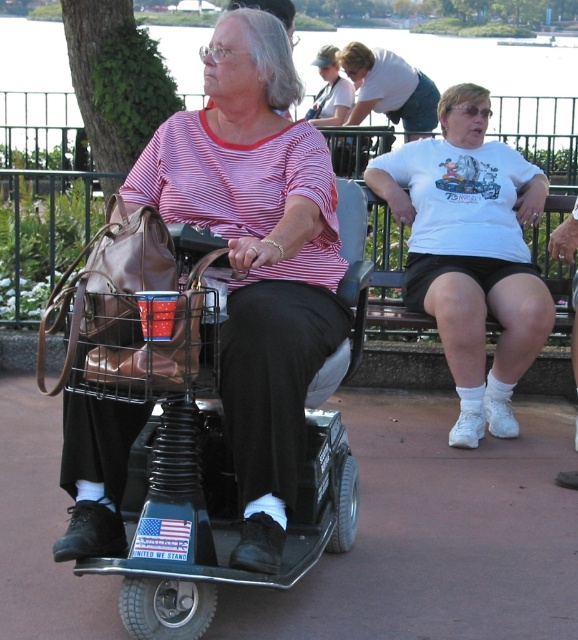
In the scene shown: You are planning to place a small bench in the park scene so that it doesn not block the view of the matte black scooter at center. According to the scene description, where should you position the bench relative to the scooter?

The bench should be positioned behind the matte black scooter at center to avoid blocking its view, as the scooter is located at the center of the scene.